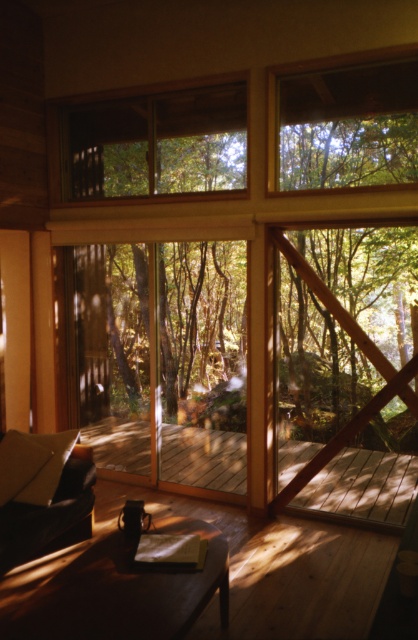
You are standing inside the room and want to look out through the clear glass window at upper center. Which direction should you move to reach it from the wooden deck at center?

The clear glass window at upper center is located above the wooden deck at center, so you should move upward to reach it.

In the scene shown: You are designing a new room layout and want to ensure that the clear glass window at upper center and the wooden deck at center are proportionate in height. Based on the scene, which object is taller?

The clear glass window at upper center is much taller than the wooden deck at center, so it is taller.